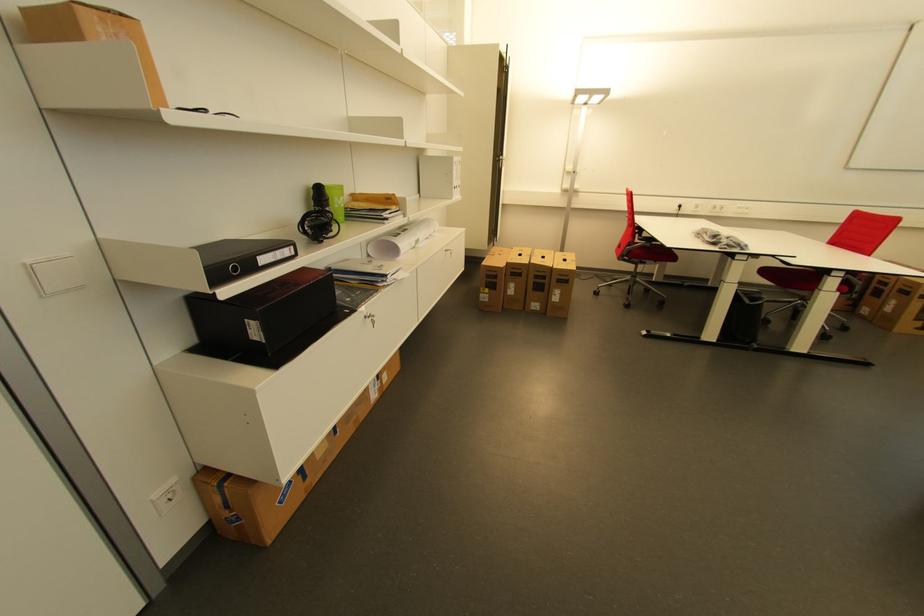
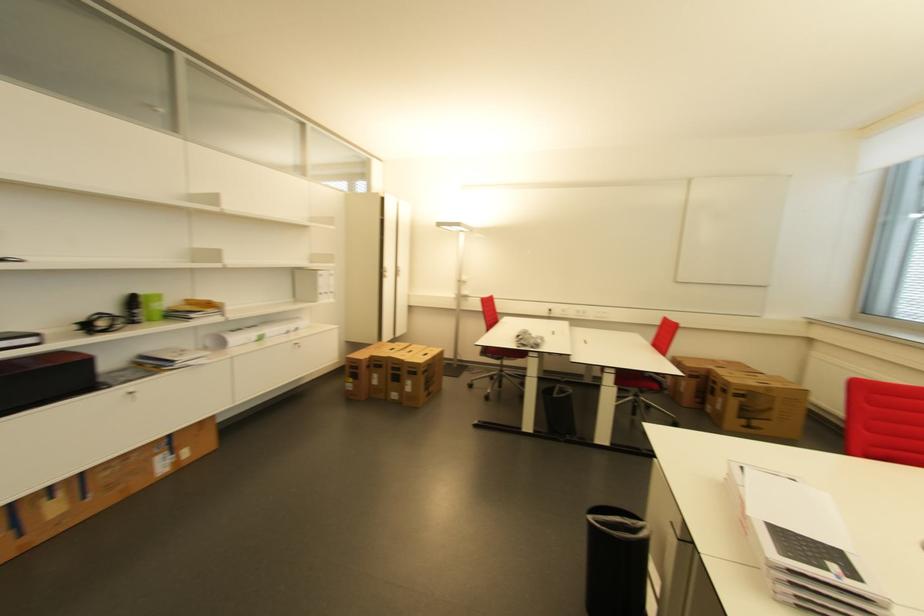
Locate, in the second image, the point that corresponds to pixel 333 193 in the first image.

(147, 301)